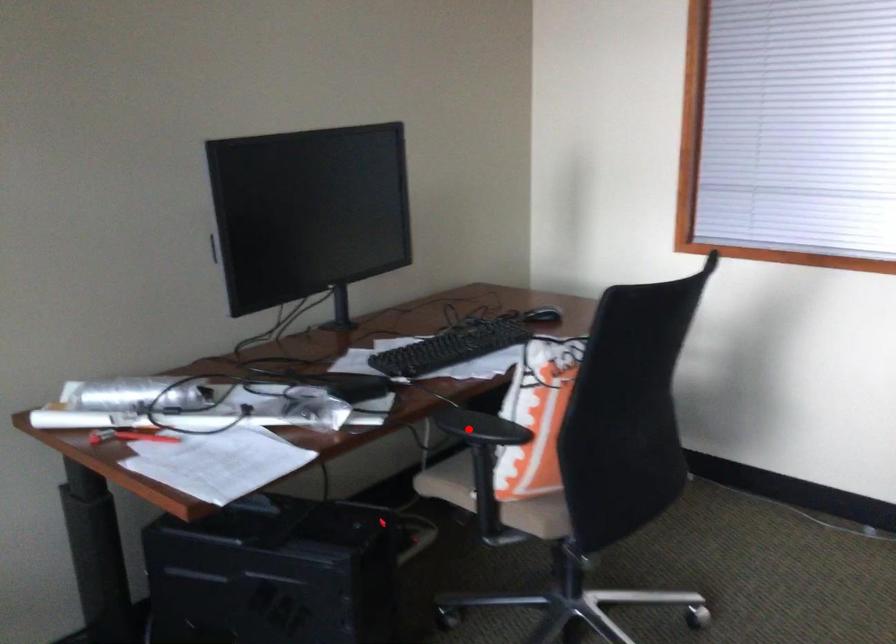
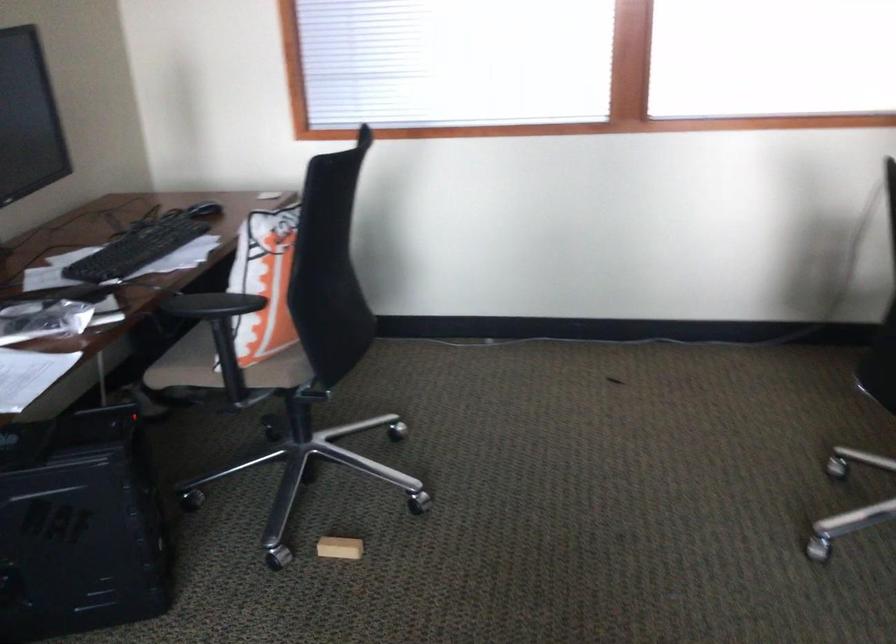
Question: I am providing you with two images of the same scene from different viewpoints. Image1 has a red point marked. In image2, the corresponding 3D location appears at what relative position? Reply with the corresponding letter.

Choices:
 (A) Closer
 (B) Farther

Answer: (B)